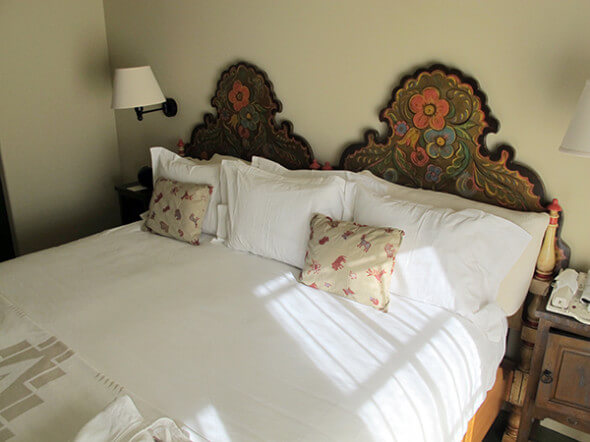
Find the location of a particular element. The height and width of the screenshot is (442, 590). pillows is located at coordinates (415, 227), (287, 205), (201, 171), (267, 165), (441, 199).